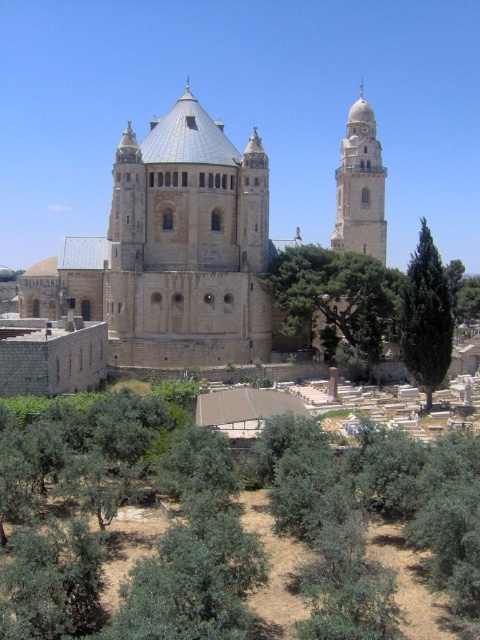
Consider the image. Who is higher up, green leafy tree at center or smooth stone tower at upper right?

smooth stone tower at upper right is higher up.

In the scene shown: Does green leafy tree at center have a lesser width compared to smooth stone tower at upper right?

Incorrect, green leafy tree at center's width is not less than smooth stone tower at upper right's.

Locate an element on the screen. This screenshot has height=640, width=480. green leafy tree at center is located at coordinates (336, 298).

Which is behind, point (200, 264) or point (408, 324)?

Positioned behind is point (200, 264).

What do you see at coordinates (172, 252) in the screenshot?
I see `beige stone church at center` at bounding box center [172, 252].

The image size is (480, 640). Find the location of `beige stone church at center`. beige stone church at center is located at coordinates (172, 252).

Image resolution: width=480 pixels, height=640 pixels. In order to click on beige stone church at center in this screenshot , I will do `click(172, 252)`.

Is green leafy tree at lower left bigger than beige stone church at center?

No.

Measure the distance between green leafy tree at lower left and camera.

green leafy tree at lower left is 34.04 meters from camera.

Find the location of a particular element. green leafy tree at lower left is located at coordinates (346, 509).